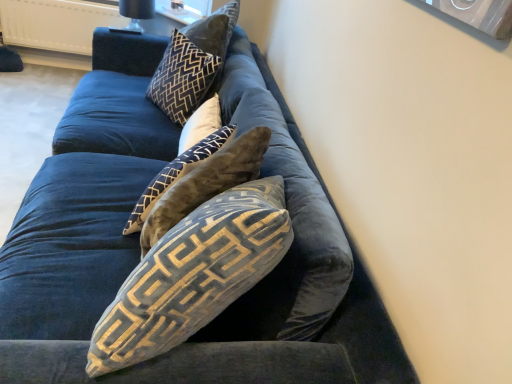
Question: Does velvet black pillow at upper center, the first pillow in the back-to-front sequence, lie behind velvet beige pillow at center, which is the second pillow in front-to-back order?

Choices:
 (A) no
 (B) yes

Answer: (B)

Question: From the image's perspective, is velvet black pillow at upper center, the first pillow in the back-to-front sequence, over velvet beige pillow at center, which is the second pillow in front-to-back order?

Choices:
 (A) no
 (B) yes

Answer: (B)

Question: Considering the relative sizes of velvet black pillow at upper center, the first pillow in the back-to-front sequence, and velvet beige pillow at center, the third pillow in the back-to-front sequence, in the image provided, is velvet black pillow at upper center, the first pillow in the back-to-front sequence, smaller than velvet beige pillow at center, the third pillow in the back-to-front sequence,?

Choices:
 (A) no
 (B) yes

Answer: (A)

Question: Considering the relative sizes of velvet black pillow at upper center, the first pillow in the back-to-front sequence, and velvet beige pillow at center, which is the second pillow in front-to-back order, in the image provided, is velvet black pillow at upper center, the first pillow in the back-to-front sequence, taller than velvet beige pillow at center, which is the second pillow in front-to-back order,?

Choices:
 (A) no
 (B) yes

Answer: (B)

Question: Is velvet beige pillow at center, the third pillow in the back-to-front sequence, inside velvet black pillow at upper center, the first pillow in the back-to-front sequence?

Choices:
 (A) no
 (B) yes

Answer: (A)

Question: In the image, is velvet beige pillow at center, which is the second pillow in front-to-back order, on the left side or the right side of black glass lamp at upper center?

Choices:
 (A) right
 (B) left

Answer: (A)

Question: Looking at the image, does velvet beige pillow at center, which is the second pillow in front-to-back order, seem bigger or smaller compared to black glass lamp at upper center?

Choices:
 (A) small
 (B) big

Answer: (B)

Question: From a real-world perspective, relative to black glass lamp at upper center, is velvet beige pillow at center, the third pillow in the back-to-front sequence, vertically above or below?

Choices:
 (A) below
 (B) above

Answer: (A)

Question: From the image's perspective, is velvet beige pillow at center, the third pillow in the back-to-front sequence, positioned above or below black glass lamp at upper center?

Choices:
 (A) below
 (B) above

Answer: (A)

Question: Is velvet black pillow at upper center, which is counted as the fourth pillow, starting from the front, in front of or behind velvet gold-patterned pillow at center, acting as the 1th pillow starting from the front, in the image?

Choices:
 (A) front
 (B) behind

Answer: (B)

Question: Considering the positions of point (166, 112) and point (163, 256), is point (166, 112) closer or farther from the camera than point (163, 256)?

Choices:
 (A) closer
 (B) farther

Answer: (B)

Question: From a real-world perspective, is velvet black pillow at upper center, which is counted as the fourth pillow, starting from the front, positioned above or below velvet gold-patterned pillow at center, positioned as the fourth pillow in back-to-front order?

Choices:
 (A) above
 (B) below

Answer: (B)

Question: Visually, is velvet black pillow at upper center, the first pillow in the back-to-front sequence, positioned to the left or to the right of velvet gold-patterned pillow at center, acting as the 1th pillow starting from the front?

Choices:
 (A) right
 (B) left

Answer: (B)

Question: Is velvet brown pillow at center, which appears as the second pillow when viewed from the back, to the left or to the right of velvet beige pillow at center, which is the second pillow in front-to-back order, in the image?

Choices:
 (A) right
 (B) left

Answer: (A)

Question: Does point (209, 97) appear closer or farther from the camera than point (176, 158)?

Choices:
 (A) closer
 (B) farther

Answer: (B)